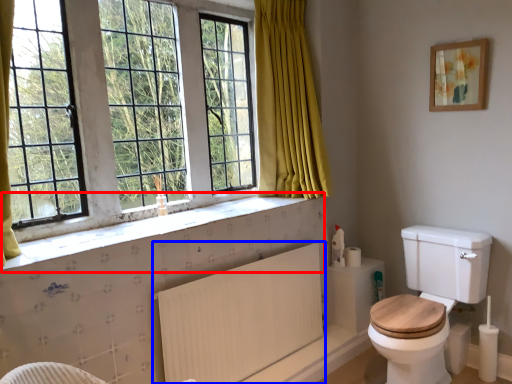
Question: Which object is further to the camera taking this photo, window sill (highlighted by a red box) or radiator (highlighted by a blue box)?

Choices:
 (A) window sill
 (B) radiator

Answer: (B)